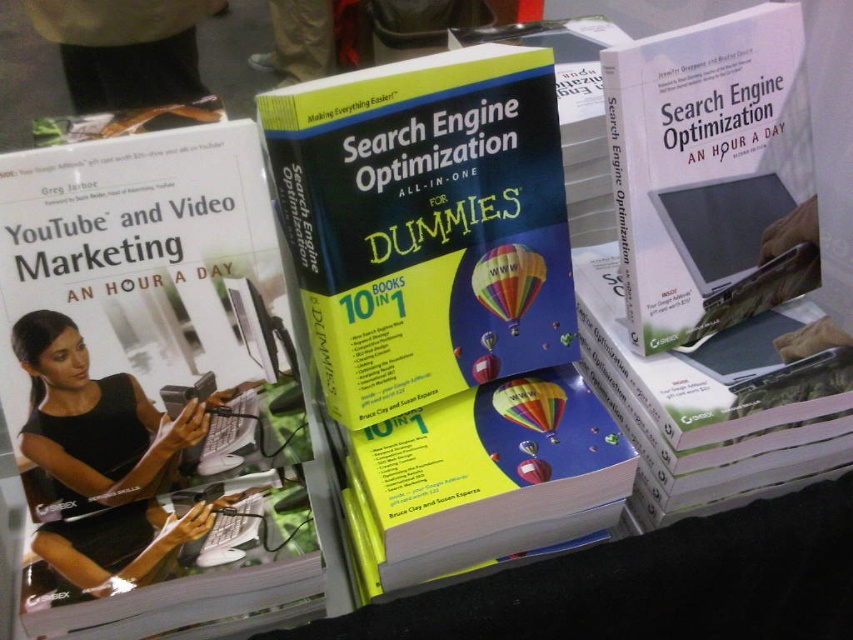
You are organizing a book fair and need to place a new book that is 12 inches wide on the table. The yellow matte book at center and the black matte laptop at lower left are already there. Can the new book fit between them if the space between them is exactly 14 inches?

The yellow matte book at center is wider than the black matte laptop at lower left. However, the space between them is 14 inches, which is larger than the new book that is 12 inches wide. Therefore, the new book can fit between them.

You are organizing a book fair and need to stack books vertically for display. You have a yellow matte book at center and a black matte laptop at lower left. Which book should you choose to place on top to ensure stability?

The yellow matte book at center has a lesser height compared to the black matte laptop at lower left, so placing the yellow matte book at center on top would provide better stability as it is shorter and less likely to topple over.